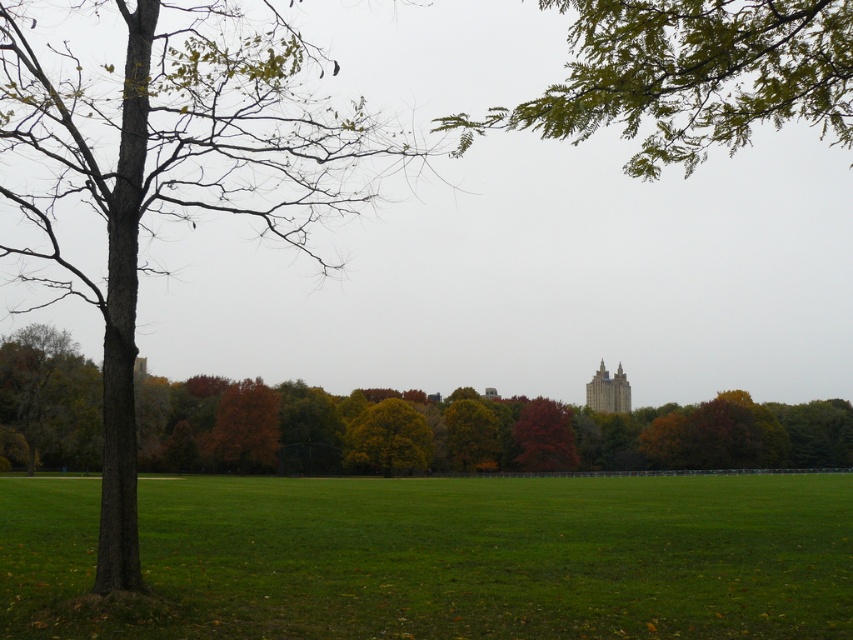
You are standing in the park and see two points marked in the image. The first point is at coordinate point(56, 401) and the second is at point(660, 74). Which point is closer to you?

Point(660, 74) is closer to you because it is in front of point(56, 401).

In the scene shown: You are a bird looking for a nesting spot. You see the green leafy branches at upper center and the shiny red tree at center. Which one is taller?

The green leafy branches at upper center is taller than the shiny red tree at center.